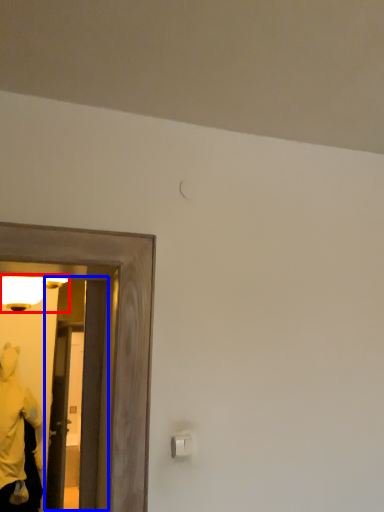
Question: Among these objects, which one is farthest to the camera, light fixture (highlighted by a red box) or glass door (highlighted by a blue box)?

Choices:
 (A) light fixture
 (B) glass door

Answer: (B)